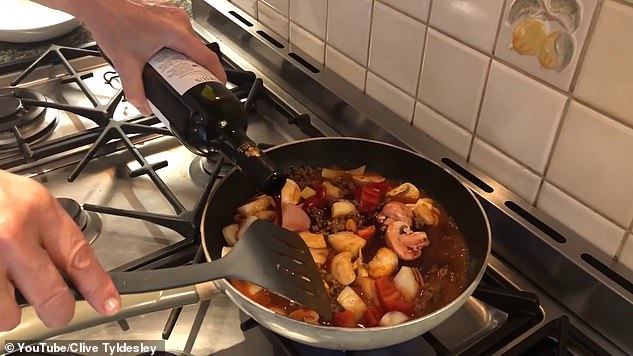
You are a GUI agent. You are given a task and a screenshot of the screen. Output one action in this format:
    pyautogui.click(x=<x>, y=<y>)
    Task: Click on the glass wine bottle
    This screenshot has width=633, height=356.
    Given the screenshot: What is the action you would take?
    pyautogui.click(x=223, y=113)